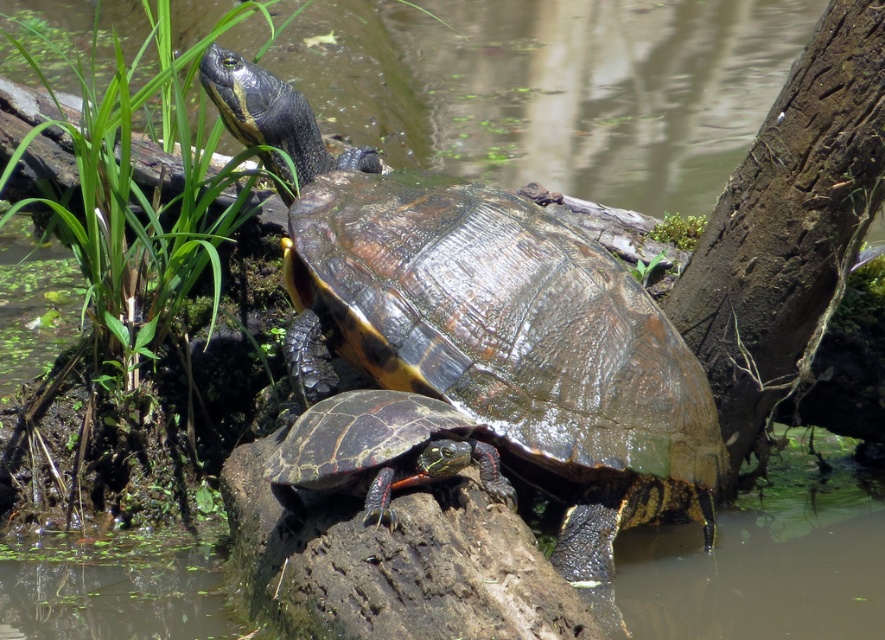
Question: From the image, what is the correct spatial relationship of shiny brown tortoise at center in relation to shiny dark green tortoise at center?

Choices:
 (A) left
 (B) right

Answer: (B)

Question: Is shiny brown tortoise at center to the right of shiny dark green tortoise at center from the viewer's perspective?

Choices:
 (A) no
 (B) yes

Answer: (B)

Question: Which point appears closest to the camera in this image?

Choices:
 (A) (282, 451)
 (B) (582, 541)

Answer: (A)

Question: Does shiny brown tortoise at center have a larger size compared to shiny dark green tortoise at center?

Choices:
 (A) yes
 (B) no

Answer: (A)